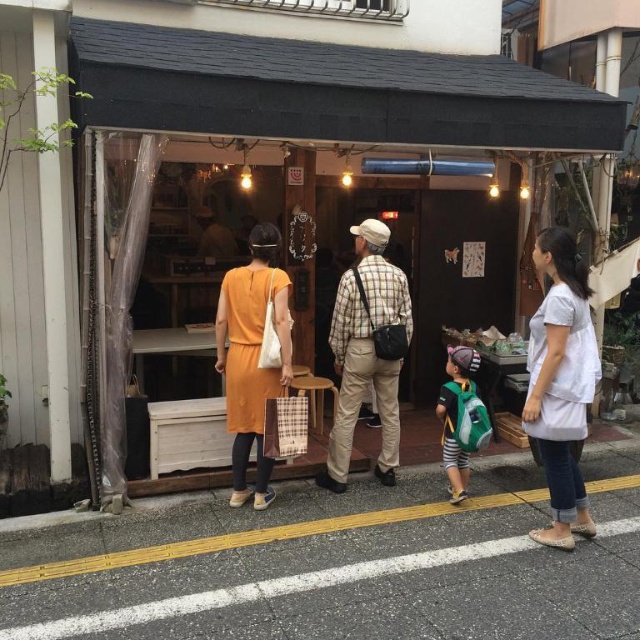
Question: Does gray asphalt at lower center appear on the left side of plaid fabric shirt at center?

Choices:
 (A) no
 (B) yes

Answer: (B)

Question: Which object is the farthest from the plaid fabric shirt at center?

Choices:
 (A) matte orange dress at center
 (B) white cotton shirt at right

Answer: (B)

Question: Can you confirm if plaid fabric shirt at center is bigger than matte orange dress at center?

Choices:
 (A) yes
 (B) no

Answer: (A)

Question: Which object is farther from the camera taking this photo?

Choices:
 (A) matte orange dress at center
 (B) plaid fabric shirt at center
 (C) gray asphalt at lower center

Answer: (B)

Question: Is white cotton shirt at right smaller than matte orange dress at center?

Choices:
 (A) yes
 (B) no

Answer: (B)

Question: Considering the real-world distances, which object is closest to the white cotton shirt at right?

Choices:
 (A) plaid fabric shirt at center
 (B) matte orange dress at center

Answer: (A)